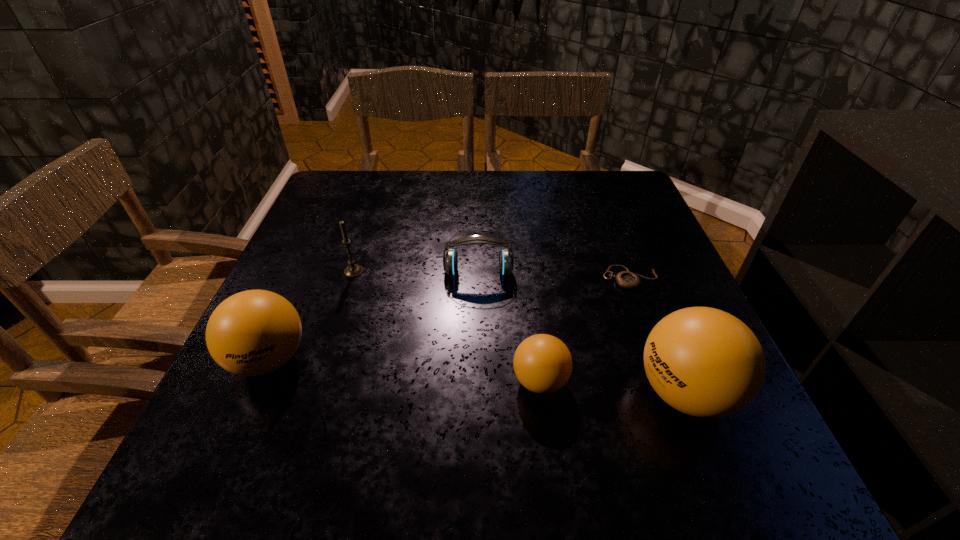
Locate an element on the screen. Image resolution: width=960 pixels, height=540 pixels. free point between the rightmost ping-pong ball and the second ping-pong ball from left to right is located at coordinates (612, 387).

Image resolution: width=960 pixels, height=540 pixels. Find the location of `free spot between the second shortest ping-pong ball and the shortest object`. free spot between the second shortest ping-pong ball and the shortest object is located at coordinates (449, 319).

Where is `vacant space that's between the candle and the headset`? The image size is (960, 540). vacant space that's between the candle and the headset is located at coordinates (416, 272).

At what (x,y) coordinates should I click in order to perform the action: click on free space between the leftmost ping-pong ball and the second ping-pong ball from left to right. Please return your answer as a coordinate pair (x, y). Looking at the image, I should click on (404, 370).

Where is `free space that is in between the candle and the second ping-pong ball from right to left`? This screenshot has width=960, height=540. free space that is in between the candle and the second ping-pong ball from right to left is located at coordinates (447, 326).

Locate an element on the screen. vacant area between the second object from left to right and the pocket watch is located at coordinates (492, 274).

I want to click on free space between the candle and the rightmost ping-pong ball, so click(x=519, y=332).

Identify which object is the second closest to the leftmost object. Please provide its 2D coordinates. Your answer should be formatted as a tuple, i.e. [(x, y)], where the tuple contains the x and y coordinates of a point satisfying the conditions above.

[(450, 263)]

Locate which object is the closest to the headset. Please provide its 2D coordinates. Your answer should be formatted as a tuple, i.e. [(x, y)], where the tuple contains the x and y coordinates of a point satisfying the conditions above.

[(353, 270)]

Locate which ping-pong ball is the closest to the shortest object. Please provide its 2D coordinates. Your answer should be formatted as a tuple, i.e. [(x, y)], where the tuple contains the x and y coordinates of a point satisfying the conditions above.

[(704, 362)]